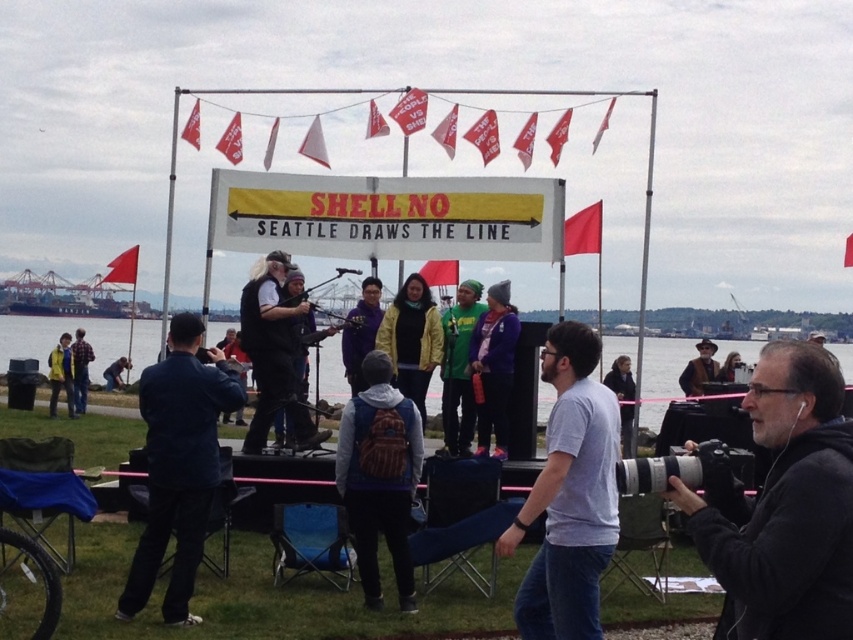
From the picture: You are a photographer at the protest scene. You need to place your black matte camera at lower right and a brown leather jacket at center for a photo. Given their sizes, which item should you position first to ensure both fit in the frame?

The black matte camera at lower right occupies less space than the brown leather jacket at center, so you should position the brown leather jacket at center first to ensure there is enough space for both items in the frame.

You are a photographer at the protest scene. You have a black matte camera at lower right and need to set it up on the green grass at lower center. Will the camera be visible above the grass when placed there?

The black matte camera at lower right is shorter than green grass at lower center, so when placed on the grass, the camera will not be visible above the grass.

You are a photographer at the protest scene. You have a black matte camera at lower right and a brown leather jacket at center. Which object is positioned to the left?

The black matte camera at lower right is positioned to the left of the brown leather jacket at center.